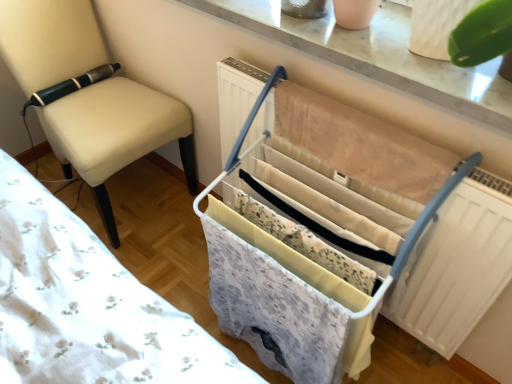
Question: From the image's perspective, is beige fabric chair at left positioned above or below white plastic drying rack at center?

Choices:
 (A) below
 (B) above

Answer: (B)

Question: Is beige fabric chair at left wider or thinner than white plastic drying rack at center?

Choices:
 (A) thin
 (B) wide

Answer: (B)

Question: Is point (54, 114) positioned closer to the camera than point (423, 220)?

Choices:
 (A) farther
 (B) closer

Answer: (A)

Question: Considering the positions of point coord(409,220) and point coord(126,144), is point coord(409,220) closer or farther from the camera than point coord(126,144)?

Choices:
 (A) farther
 (B) closer

Answer: (B)

Question: From a real-world perspective, relative to beige fabric chair at left, is white plastic drying rack at center vertically above or below?

Choices:
 (A) above
 (B) below

Answer: (B)

Question: Is white plastic drying rack at center spatially inside beige fabric chair at left, or outside of it?

Choices:
 (A) outside
 (B) inside

Answer: (A)

Question: In terms of height, does white plastic drying rack at center look taller or shorter compared to beige fabric chair at left?

Choices:
 (A) tall
 (B) short

Answer: (B)